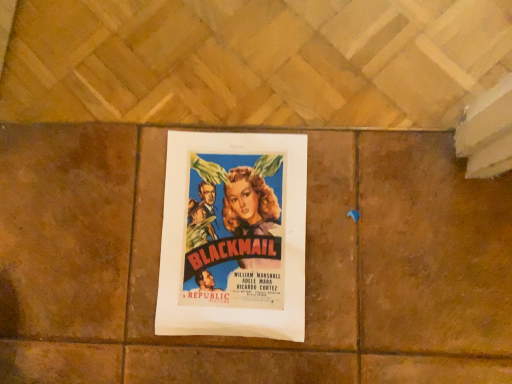
This screenshot has height=384, width=512. What do you see at coordinates (233, 236) in the screenshot?
I see `matte paper poster at center` at bounding box center [233, 236].

You are a GUI agent. You are given a task and a screenshot of the screen. Output one action in this format:
    pyautogui.click(x=<x>, y=<y>)
    Task: Click on the matte paper poster at center
    
    Given the screenshot: What is the action you would take?
    pyautogui.click(x=233, y=236)

You are a GUI agent. You are given a task and a screenshot of the screen. Output one action in this format:
    pyautogui.click(x=<x>, y=<y>)
    Task: Click on the matte paper poster at center
    This screenshot has width=512, height=384.
    Given the screenshot: What is the action you would take?
    pyautogui.click(x=233, y=236)